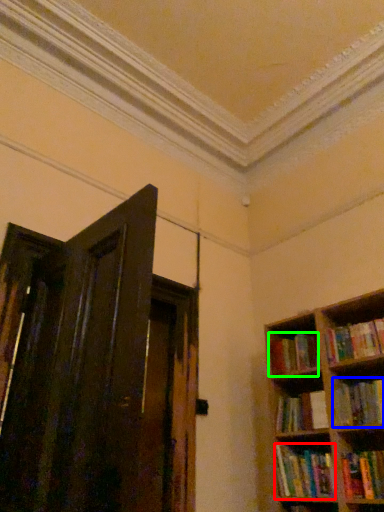
Question: Which object is the closest to the book (highlighted by a red box)? Choose among these: book (highlighted by a blue box) or book (highlighted by a green box).

Choices:
 (A) book
 (B) book

Answer: (A)